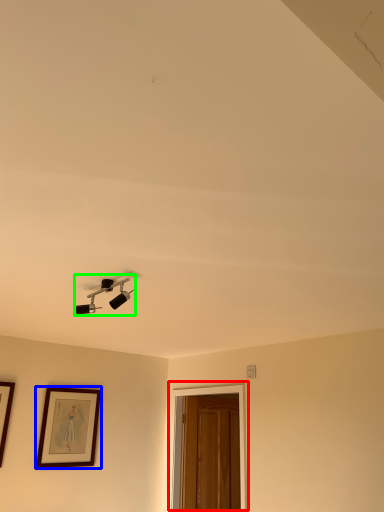
Question: Which is nearer to the glass door (highlighted by a red box)? picture frame (highlighted by a blue box) or lamp (highlighted by a green box).

Choices:
 (A) picture frame
 (B) lamp

Answer: (A)